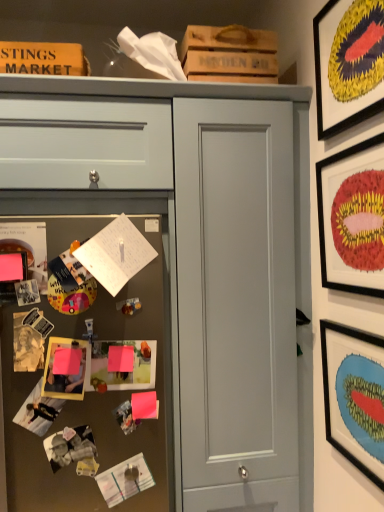
Question: From the image's perspective, relative to metallic silver fridge at left, is matte black picture frame at upper right, marked as the 2th picture frame in a top-to-bottom arrangement, above or below?

Choices:
 (A) above
 (B) below

Answer: (A)

Question: Is matte black picture frame at upper right, marked as the 2th picture frame in a top-to-bottom arrangement, bigger or smaller than metallic silver fridge at left?

Choices:
 (A) big
 (B) small

Answer: (B)

Question: Which object is the closest to the matte yellow picture frame at lower left, which is counted as the 3th picture frame, starting from the top?

Choices:
 (A) white paper at left
 (B) black matte picture frame at upper right, the first picture frame positioned from the bottom
 (C) matte gray door at center
 (D) matte black picture frame at upper right, the third picture frame ordered from the bottom
 (E) wooden framed artwork at upper right, marked as the 2th picture frame in a right-to-left arrangement

Answer: (A)

Question: Which of these objects is positioned closest to the white paper at left?

Choices:
 (A) matte yellow picture frame at lower left, the 1th picture frame when ordered from left to right
 (B) black matte picture frame at upper right, which ranks as the 1th picture frame in right-to-left order
 (C) matte black picture frame at upper right, marked as the 2th picture frame in a top-to-bottom arrangement
 (D) matte gray door at center
 (E) metallic silver fridge at left

Answer: (E)